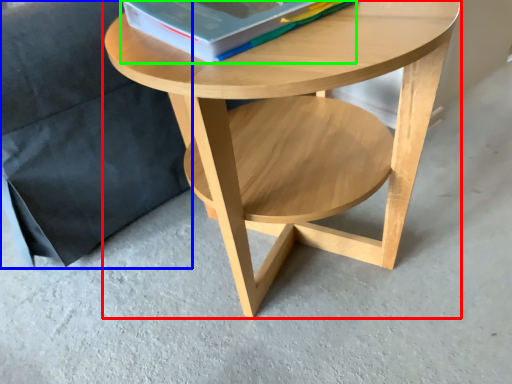
Question: Estimate the real-world distances between objects in this image. Which object is farther from coffee table (highlighted by a red box), armchair (highlighted by a blue box) or paperback book (highlighted by a green box)?

Choices:
 (A) armchair
 (B) paperback book

Answer: (A)